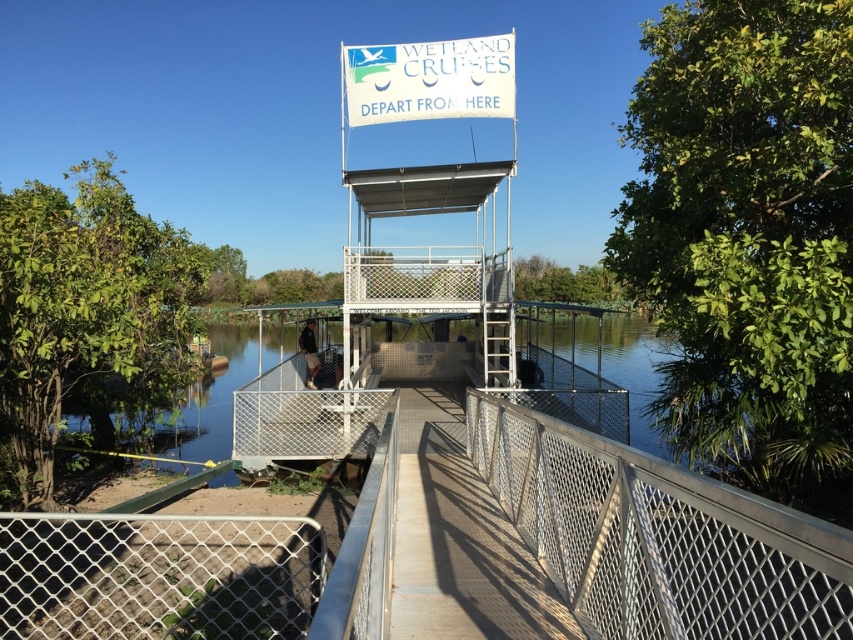
You are a visitor at the wetland cruise embarkation point. You need to decide whether to stand on the white mesh fence at center or the white metal observation tower at center for a better view. Which one would allow you to see more of the surrounding wetlands?

The white metal observation tower at center is taller than the white mesh fence at center, so standing on the white metal observation tower at center would provide a better view of the surrounding wetlands.

You are a visitor standing at the embarkation point and want to see the entire wetland area. The white metal observation tower at center and the white mesh fence at center are both in your way. Which object should you move to have an unobstructed view?

The white mesh fence at center is taller than the white metal observation tower at center, so you should move the white mesh fence at center to have an unobstructed view.